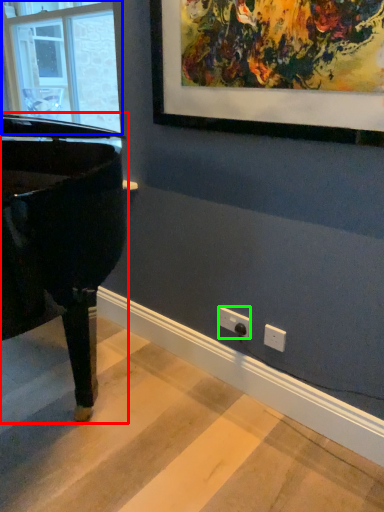
Question: Which is nearer to the piano (highlighted by a red box)? window (highlighted by a blue box) or electric outlet (highlighted by a green box).

Choices:
 (A) window
 (B) electric outlet

Answer: (B)